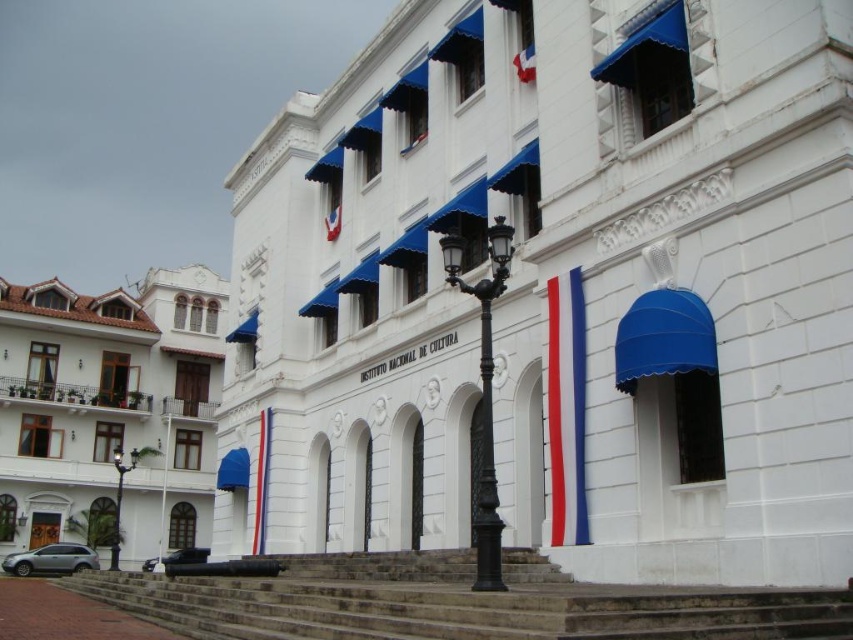
You are standing in front of the grand white building with classical architecture. You see a point labeled at coordinates (x=109, y=410). Based on the description, what does this point represent?

The point at coordinates (x=109, y=410) represents the white stucco building at left.

You are standing in front of the building and notice the white stucco building at left and the red fabric flag at center. Which object is positioned further to the left?

The white stucco building at left is positioned further to the left than the red fabric flag at center.